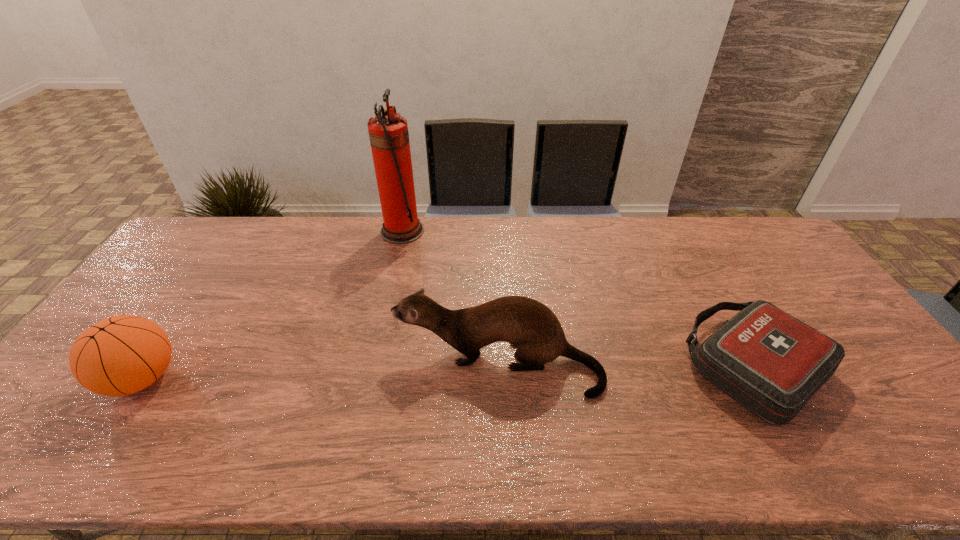
You are a GUI agent. You are given a task and a screenshot of the screen. Output one action in this format:
    pyautogui.click(x=<x>, y=<y>)
    Task: Click on the farthest object
    The image size is (960, 540).
    Given the screenshot: What is the action you would take?
    pyautogui.click(x=388, y=133)

Find the location of a particular element. Image resolution: width=960 pixels, height=540 pixels. fire extinguisher is located at coordinates (388, 133).

Where is `ferret`? This screenshot has height=540, width=960. ferret is located at coordinates (526, 323).

In order to click on the leftmost object in this screenshot , I will do `click(121, 355)`.

The height and width of the screenshot is (540, 960). I want to click on the rightmost object, so click(771, 363).

Identify the location of the shortest object. The image size is (960, 540). (771, 363).

You are a GUI agent. You are given a task and a screenshot of the screen. Output one action in this format:
    pyautogui.click(x=<x>, y=<y>)
    Task: Click on the vacant space located 0.290m at the discharge end of the farthest object
    
    Given the screenshot: What is the action you would take?
    pyautogui.click(x=505, y=231)

In order to click on free space located 0.330m at the face of the ferret in this screenshot , I will do `click(269, 364)`.

Locate an element on the screen. The width and height of the screenshot is (960, 540). vacant space located at the face of the ferret is located at coordinates (280, 364).

What are the coordinates of `blank area located 0.330m at the face of the ferret` in the screenshot? It's located at (269, 364).